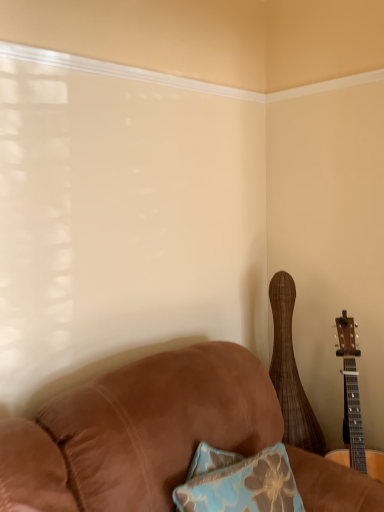
Question: Is wooden acoustic guitar at right, which is the second guitar from right to left, in front of or behind natural wood acoustic guitar at right, positioned as the 2th guitar in left-to-right order, in the image?

Choices:
 (A) front
 (B) behind

Answer: (B)

Question: From the image's perspective, relative to natural wood acoustic guitar at right, positioned as the 2th guitar in left-to-right order, is wooden acoustic guitar at right, which appears as the first guitar when viewed from the left, above or below?

Choices:
 (A) below
 (B) above

Answer: (B)

Question: Looking at their shapes, would you say wooden acoustic guitar at right, which appears as the first guitar when viewed from the left, is wider or thinner than natural wood acoustic guitar at right, marked as the 1th guitar in a right-to-left arrangement?

Choices:
 (A) thin
 (B) wide

Answer: (A)

Question: Looking at the image, does natural wood acoustic guitar at right, positioned as the 2th guitar in left-to-right order, seem bigger or smaller compared to wooden acoustic guitar at right, which appears as the first guitar when viewed from the left?

Choices:
 (A) small
 (B) big

Answer: (B)

Question: From a real-world perspective, is natural wood acoustic guitar at right, positioned as the 2th guitar in left-to-right order, physically located above or below wooden acoustic guitar at right, which appears as the first guitar when viewed from the left?

Choices:
 (A) below
 (B) above

Answer: (A)

Question: From their relative heights in the image, would you say natural wood acoustic guitar at right, positioned as the 2th guitar in left-to-right order, is taller or shorter than wooden acoustic guitar at right, which is the second guitar from right to left?

Choices:
 (A) tall
 (B) short

Answer: (B)

Question: Based on their positions, is natural wood acoustic guitar at right, marked as the 1th guitar in a right-to-left arrangement, located to the left or right of wooden acoustic guitar at right, which appears as the first guitar when viewed from the left?

Choices:
 (A) left
 (B) right

Answer: (B)